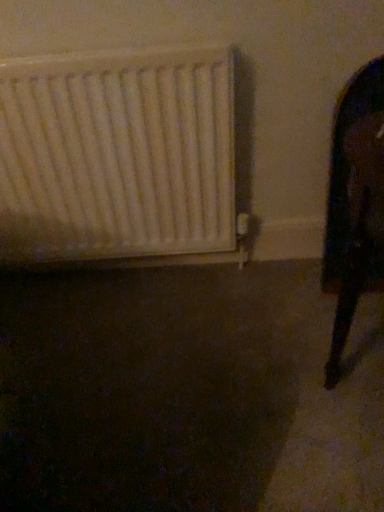
Question: From a real-world perspective, is black glossy mirror at right physically located above or below white matte radiator at left?

Choices:
 (A) above
 (B) below

Answer: (B)

Question: Considering the positions of point (379, 160) and point (56, 108), is point (379, 160) closer or farther from the camera than point (56, 108)?

Choices:
 (A) farther
 (B) closer

Answer: (B)

Question: Is black glossy mirror at right wider or thinner than white matte radiator at left?

Choices:
 (A) wide
 (B) thin

Answer: (A)

Question: From their relative heights in the image, would you say white matte radiator at left is taller or shorter than black glossy mirror at right?

Choices:
 (A) tall
 (B) short

Answer: (B)

Question: Considering the positions of white matte radiator at left and black glossy mirror at right in the image, is white matte radiator at left bigger or smaller than black glossy mirror at right?

Choices:
 (A) small
 (B) big

Answer: (B)

Question: Is white matte radiator at left situated inside black glossy mirror at right or outside?

Choices:
 (A) inside
 (B) outside

Answer: (B)

Question: Is white matte radiator at left to the left or to the right of black glossy mirror at right in the image?

Choices:
 (A) left
 (B) right

Answer: (A)